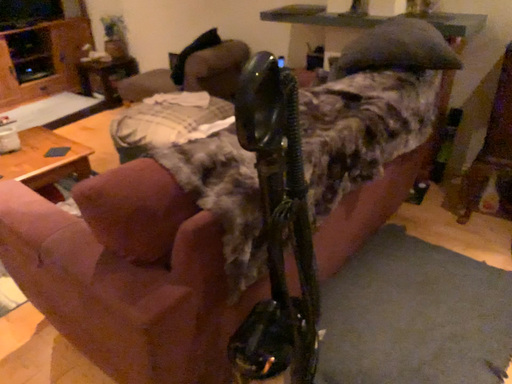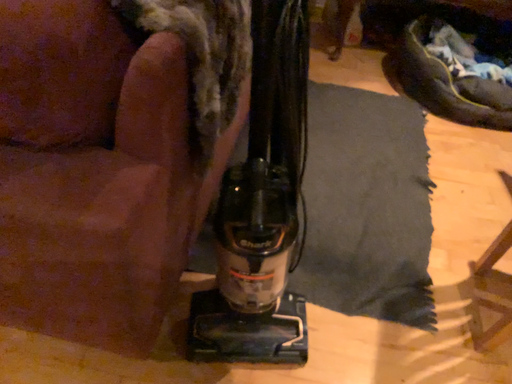
Question: How did the camera likely rotate when shooting the video?

Choices:
 (A) rotated left
 (B) rotated right

Answer: (B)